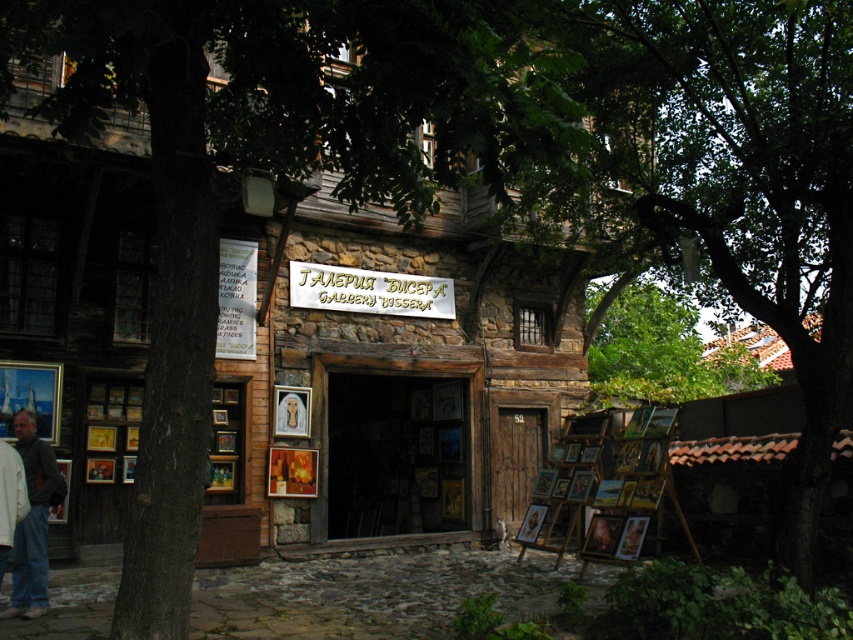
Question: Which of these objects is positioned closest to the denim jacket at lower left?

Choices:
 (A) green leafy tree at upper left
 (B) gold metallic sign at center

Answer: (A)

Question: Which object is positioned farthest from the gold metallic sign at center?

Choices:
 (A) green leafy tree at upper left
 (B) denim jacket at lower left

Answer: (B)

Question: Is green leafy tree at upper left bigger than gold metallic sign at center?

Choices:
 (A) no
 (B) yes

Answer: (B)

Question: Does green leafy tree at upper left appear under denim jacket at lower left?

Choices:
 (A) yes
 (B) no

Answer: (B)

Question: Does green leafy tree at upper left appear on the right side of denim jacket at lower left?

Choices:
 (A) yes
 (B) no

Answer: (A)

Question: Among these points, which one is nearest to the camera?

Choices:
 (A) (316, 282)
 (B) (15, 580)

Answer: (B)